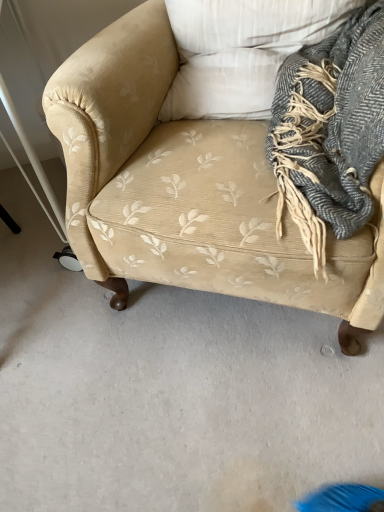
Question: Would you say gray wool scarf at upper right is inside or outside beige corduroy couch at center?

Choices:
 (A) outside
 (B) inside

Answer: (B)

Question: Is gray wool scarf at upper right to the left or to the right of beige corduroy couch at center in the image?

Choices:
 (A) left
 (B) right

Answer: (B)

Question: Which object is the closest to the gray wool scarf at upper right?

Choices:
 (A) beige corduroy couch at center
 (B) white textured pillow at upper center

Answer: (B)

Question: Based on their relative distances, which object is nearer to the beige corduroy couch at center?

Choices:
 (A) gray wool scarf at upper right
 (B) white textured pillow at upper center

Answer: (B)